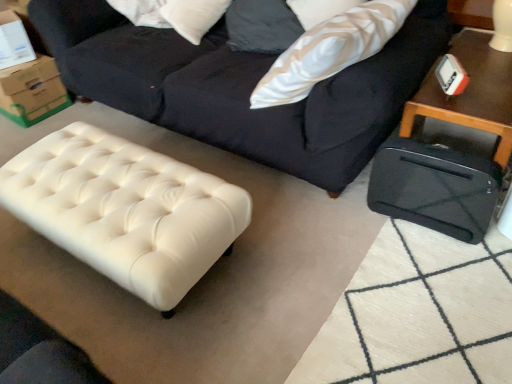
Question: Can you confirm if white leather ottoman at lower left, arranged as the second table when viewed from the right, is smaller than white textured pillow at upper right?

Choices:
 (A) no
 (B) yes

Answer: (A)

Question: Is white leather ottoman at lower left, marked as the 1th table in a left-to-right arrangement, not within white textured pillow at upper right?

Choices:
 (A) no
 (B) yes

Answer: (B)

Question: Considering the relative sizes of white leather ottoman at lower left, marked as the 1th table in a left-to-right arrangement, and white textured pillow at upper right in the image provided, is white leather ottoman at lower left, marked as the 1th table in a left-to-right arrangement, bigger than white textured pillow at upper right?

Choices:
 (A) yes
 (B) no

Answer: (A)

Question: From a real-world perspective, is white leather ottoman at lower left, arranged as the second table when viewed from the right, positioned under white textured pillow at upper right based on gravity?

Choices:
 (A) no
 (B) yes

Answer: (B)

Question: Is white leather ottoman at lower left, marked as the 1th table in a left-to-right arrangement, further to camera compared to white textured pillow at upper right?

Choices:
 (A) no
 (B) yes

Answer: (A)

Question: Is white leather ottoman at lower left, marked as the 1th table in a left-to-right arrangement, shorter than white textured pillow at upper right?

Choices:
 (A) no
 (B) yes

Answer: (B)

Question: Is white textured pillow at upper right positioned behind dark blue fabric studio couch at upper center?

Choices:
 (A) yes
 (B) no

Answer: (A)

Question: Is white textured pillow at upper right to the left of dark blue fabric studio couch at upper center from the viewer's perspective?

Choices:
 (A) yes
 (B) no

Answer: (B)

Question: Is white textured pillow at upper right surrounding dark blue fabric studio couch at upper center?

Choices:
 (A) no
 (B) yes

Answer: (A)

Question: Is white textured pillow at upper right wider than dark blue fabric studio couch at upper center?

Choices:
 (A) yes
 (B) no

Answer: (B)

Question: Does white textured pillow at upper right have a lesser height compared to dark blue fabric studio couch at upper center?

Choices:
 (A) yes
 (B) no

Answer: (A)

Question: Is white textured pillow at upper right smaller than dark blue fabric studio couch at upper center?

Choices:
 (A) no
 (B) yes

Answer: (B)

Question: From a real-world perspective, does green cardboard box at upper left stand above white textured pillow at upper right?

Choices:
 (A) no
 (B) yes

Answer: (A)